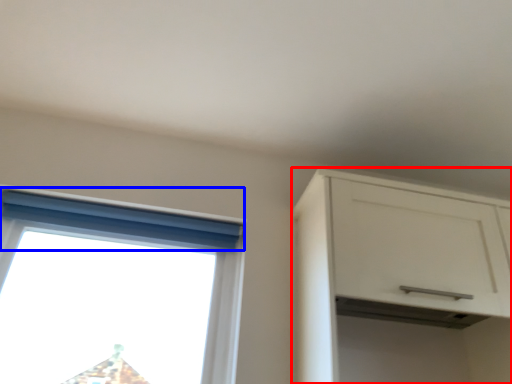
Question: Which object is closer to the camera taking this photo, cabinetry (highlighted by a red box) or curtain (highlighted by a blue box)?

Choices:
 (A) cabinetry
 (B) curtain

Answer: (A)